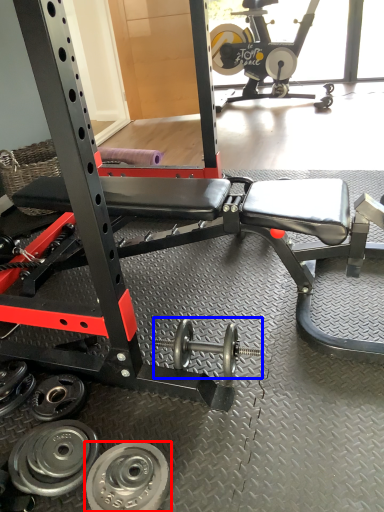
Question: Which object is further to the camera taking this photo, wheel (highlighted by a red box) or dumbbell (highlighted by a blue box)?

Choices:
 (A) wheel
 (B) dumbbell

Answer: (B)